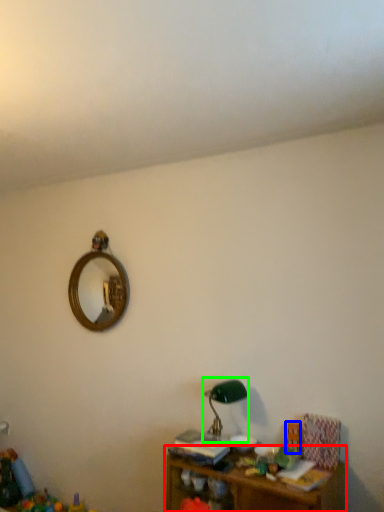
Question: Considering the real-world distances, which object is closest to shelf (highlighted by a red box)? toy (highlighted by a blue box) or table lamp (highlighted by a green box).

Choices:
 (A) toy
 (B) table lamp

Answer: (A)